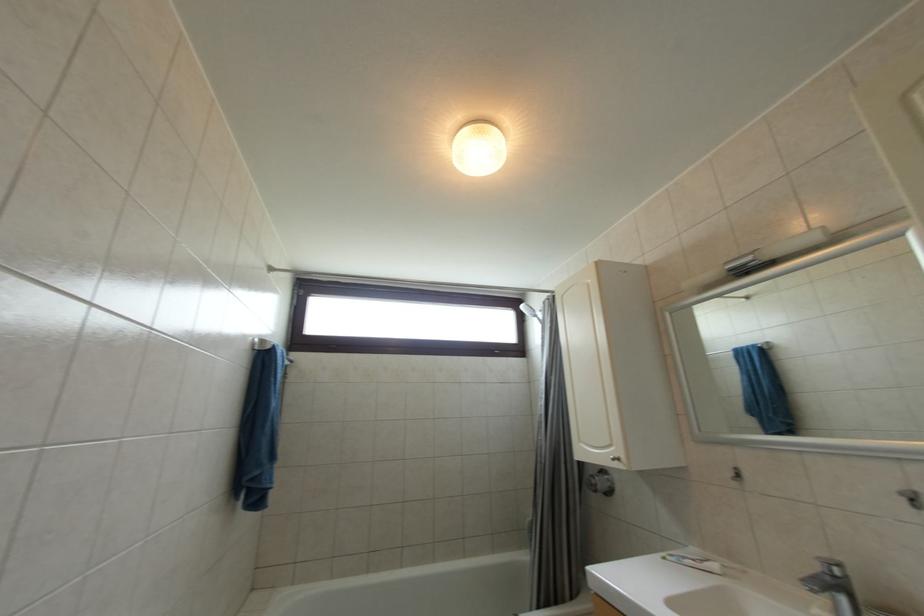
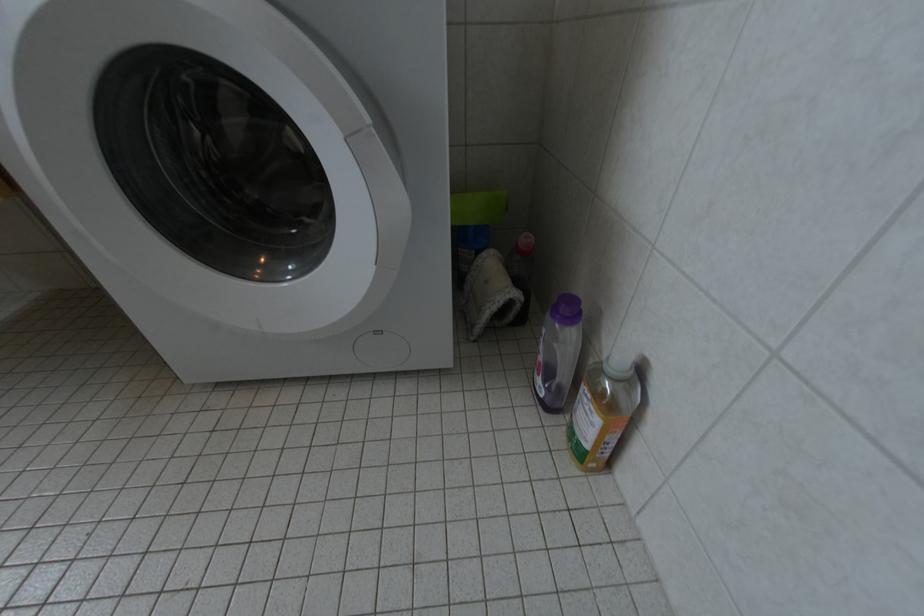
The images are taken continuously from a first-person perspective. In which direction is your viewpoint rotating?

The camera's rotation is toward right-down.